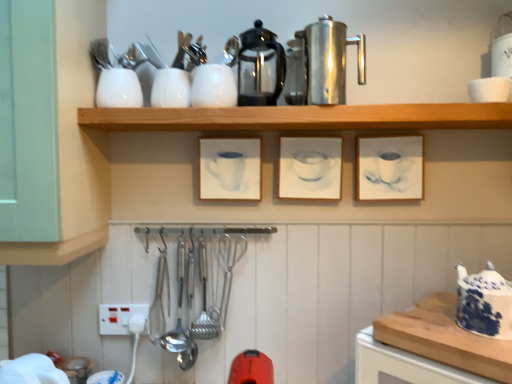
Question: From the image's perspective, relative to matte white frame at center right, which is the 3th picture frame from left to right, is wooden cutting board at lower right above or below?

Choices:
 (A) above
 (B) below

Answer: (B)

Question: Is wooden cutting board at lower right to the left or to the right of matte white frame at center right, which is the 3th picture frame from left to right, in the image?

Choices:
 (A) left
 (B) right

Answer: (B)

Question: Estimate the real-world distances between objects in this image. Which object is closer to the wooden cutting board at lower right?

Choices:
 (A) white matte cup at center, the third picture frame viewed from the right
 (B) white glossy cup at upper center, marked as the 3th tableware in a right-to-left arrangement
 (C) shiny glass coffeepot at center, which is counted as the 1th coffeepot, starting from the left
 (D) white glossy vase at upper center, the second tableware viewed from the right
 (E) white glossy bowl at upper right, positioned as the fourth tableware in left-to-right order

Answer: (A)

Question: Considering the real-world distances, which object is closest to the white glossy bowl at upper right, the first tableware viewed from the right?

Choices:
 (A) matte white frame at center right, which is the first picture frame from right to left
 (B) blue and white ceramic teapot at right
 (C) shiny glass coffeepot at center, which is counted as the 1th coffeepot, starting from the left
 (D) white matte cup at center, which is the first picture frame in left-to-right order
 (E) white glossy cup at upper left, placed as the 1th tableware when sorted from left to right

Answer: (A)